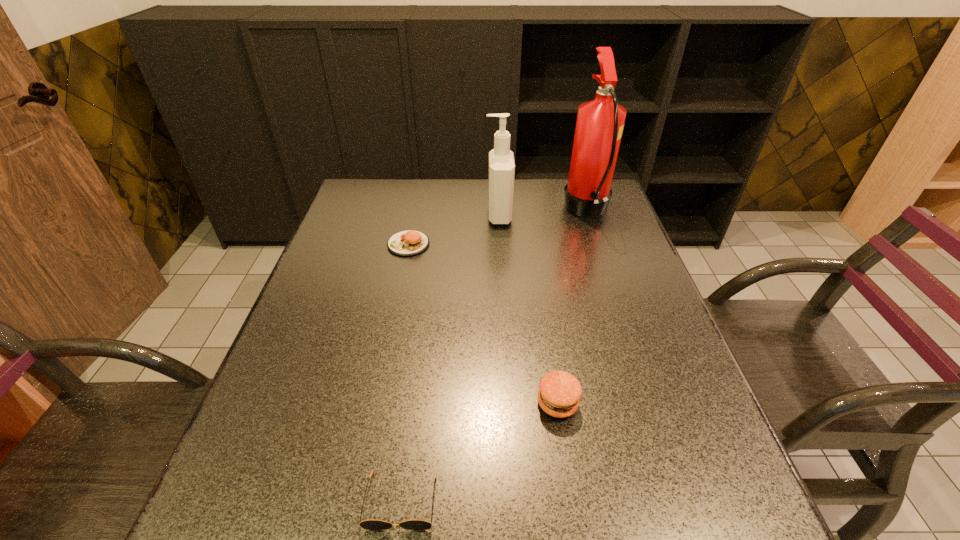
Identify the location of object that is at the right edge. The height and width of the screenshot is (540, 960). (600, 122).

Where is `object present at the far right corner`? object present at the far right corner is located at coordinates (600, 122).

Where is `vacant space at the far edge of the desktop`? Image resolution: width=960 pixels, height=540 pixels. vacant space at the far edge of the desktop is located at coordinates (540, 185).

At what (x,y) coordinates should I click in order to perform the action: click on free space at the near edge. Please return your answer as a coordinate pair (x, y). Looking at the image, I should click on (534, 539).

I want to click on free space at the left edge of the desktop, so click(x=332, y=321).

This screenshot has width=960, height=540. I want to click on vacant area at the right edge of the desktop, so pos(596,279).

The height and width of the screenshot is (540, 960). I want to click on vacant region at the far left corner of the desktop, so click(369, 201).

I want to click on vacant space at the near left corner of the desktop, so click(x=295, y=527).

Image resolution: width=960 pixels, height=540 pixels. I want to click on vacant space at the near right corner of the desktop, so click(x=736, y=511).

The image size is (960, 540). What are the coordinates of `vacant area between the second tallest object and the sunglasses` in the screenshot? It's located at (449, 358).